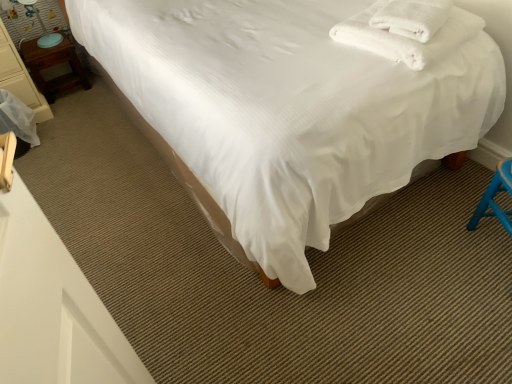
Identify the location of vacant area that lies in front of wooden nightstand at left. (74, 105).